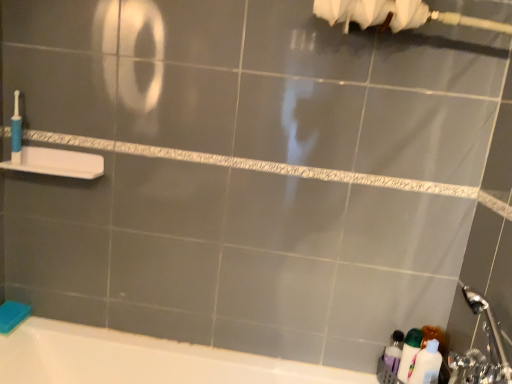
Question: From a real-world perspective, is blue plastic toothbrush at left physically above translucent plastic bottles at lower right?

Choices:
 (A) yes
 (B) no

Answer: (A)

Question: Can you confirm if blue plastic toothbrush at left is bigger than translucent plastic bottles at lower right?

Choices:
 (A) yes
 (B) no

Answer: (B)

Question: Is blue plastic toothbrush at left shorter than translucent plastic bottles at lower right?

Choices:
 (A) yes
 (B) no

Answer: (A)

Question: From the image's perspective, does blue plastic toothbrush at left appear lower than translucent plastic bottles at lower right?

Choices:
 (A) yes
 (B) no

Answer: (B)

Question: Is blue plastic toothbrush at left facing towards translucent plastic bottles at lower right?

Choices:
 (A) no
 (B) yes

Answer: (A)

Question: From the image's perspective, is white glossy bottle at lower right positioned above or below translucent plastic bottles at lower right?

Choices:
 (A) above
 (B) below

Answer: (A)

Question: From a real-world perspective, is white glossy bottle at lower right physically located above or below translucent plastic bottles at lower right?

Choices:
 (A) above
 (B) below

Answer: (B)

Question: Is white glossy bottle at lower right in front of or behind translucent plastic bottles at lower right in the image?

Choices:
 (A) front
 (B) behind

Answer: (B)

Question: Is point (403, 342) closer or farther from the camera than point (432, 367)?

Choices:
 (A) farther
 (B) closer

Answer: (A)

Question: From a real-world perspective, is translucent plastic bottles at lower right above or below white plastic shelf at left?

Choices:
 (A) below
 (B) above

Answer: (A)

Question: From the image's perspective, is translucent plastic bottles at lower right positioned above or below white plastic shelf at left?

Choices:
 (A) below
 (B) above

Answer: (A)

Question: In terms of height, does translucent plastic bottles at lower right look taller or shorter compared to white plastic shelf at left?

Choices:
 (A) tall
 (B) short

Answer: (A)

Question: Is translucent plastic bottles at lower right wider or thinner than white plastic shelf at left?

Choices:
 (A) thin
 (B) wide

Answer: (A)

Question: From a real-world perspective, relative to blue plastic toothbrush at left, is white plastic shelf at left vertically above or below?

Choices:
 (A) above
 (B) below

Answer: (B)

Question: In the image, is white plastic shelf at left on the left side or the right side of blue plastic toothbrush at left?

Choices:
 (A) left
 (B) right

Answer: (B)